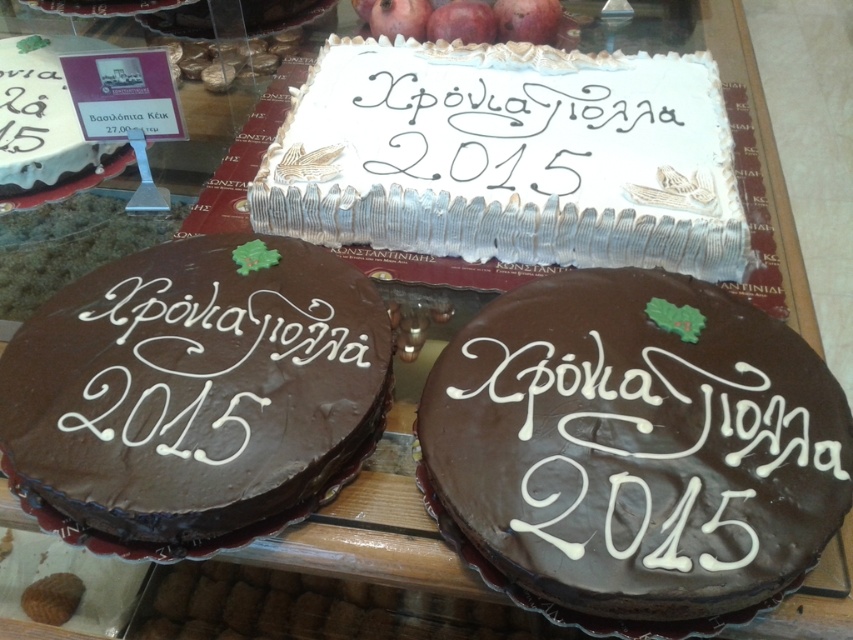
How much distance is there between chocolatesmoothcake at lower center and white matte cake at upper left?

chocolatesmoothcake at lower center and white matte cake at upper left are 34.00 inches apart.

Is the position of chocolatesmoothcake at lower center less distant than that of white matte cake at upper left?

Yes, chocolatesmoothcake at lower center is closer to the viewer.

Identify the location of chocolatesmoothcake at lower center. (636, 445).

Between chocolatesmoothcake at center and white matte cake at upper left, which one appears on the left side from the viewer's perspective?

Positioned to the left is white matte cake at upper left.

Identify the location of chocolatesmoothcake at center. (194, 396).

Between point (108, 451) and point (45, 132), which one is positioned behind?

The point (45, 132) is behind.

This screenshot has height=640, width=853. Find the location of `chocolatesmoothcake at center`. chocolatesmoothcake at center is located at coordinates (194, 396).

Which is above, white cream cake at center or chocolatesmoothcake at lower left?

white cream cake at center is above.

Is white cream cake at center shorter than chocolatesmoothcake at lower left?

No, white cream cake at center is not shorter than chocolatesmoothcake at lower left.

The width and height of the screenshot is (853, 640). I want to click on white cream cake at center, so click(x=509, y=157).